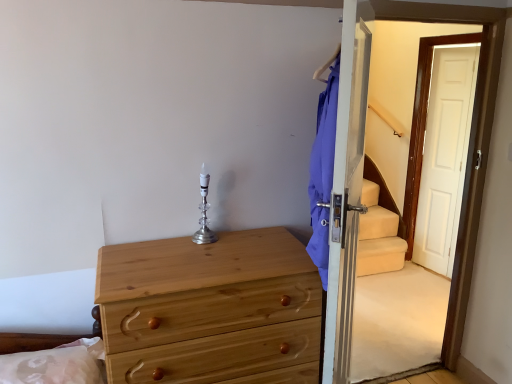
Question: In the image, is transparent glass screen door at right on the left side or the right side of natural wood chest of drawers at lower left?

Choices:
 (A) left
 (B) right

Answer: (B)

Question: Does point (391, 36) appear closer or farther from the camera than point (311, 271)?

Choices:
 (A) closer
 (B) farther

Answer: (B)

Question: Which object is positioned farthest from the silky white pillow at lower left?

Choices:
 (A) silver/crystal candle holder at center
 (B) transparent glass screen door at right
 (C) natural wood chest of drawers at lower left

Answer: (B)

Question: Which object is the farthest from the silky white pillow at lower left?

Choices:
 (A) transparent glass screen door at right
 (B) natural wood chest of drawers at lower left
 (C) silver/crystal candle holder at center

Answer: (A)